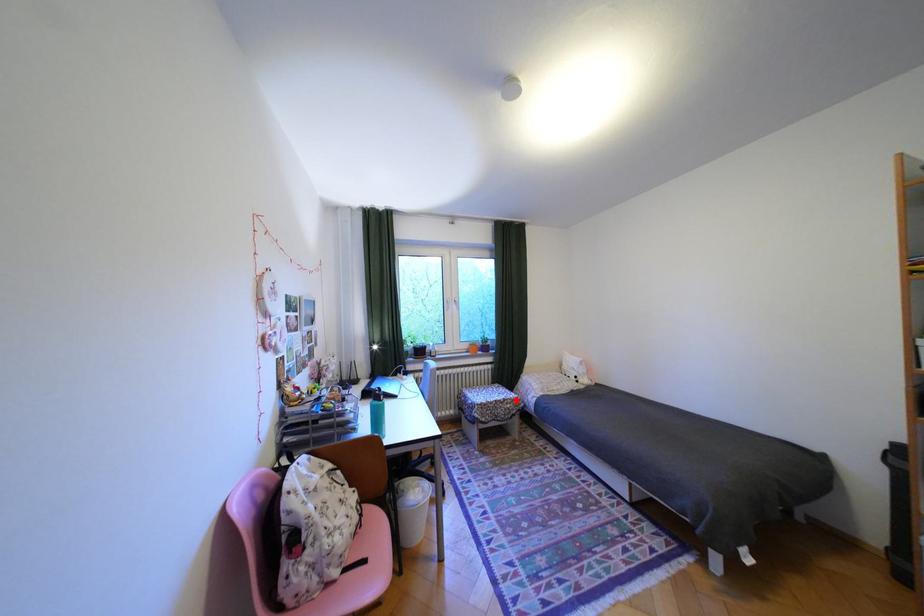
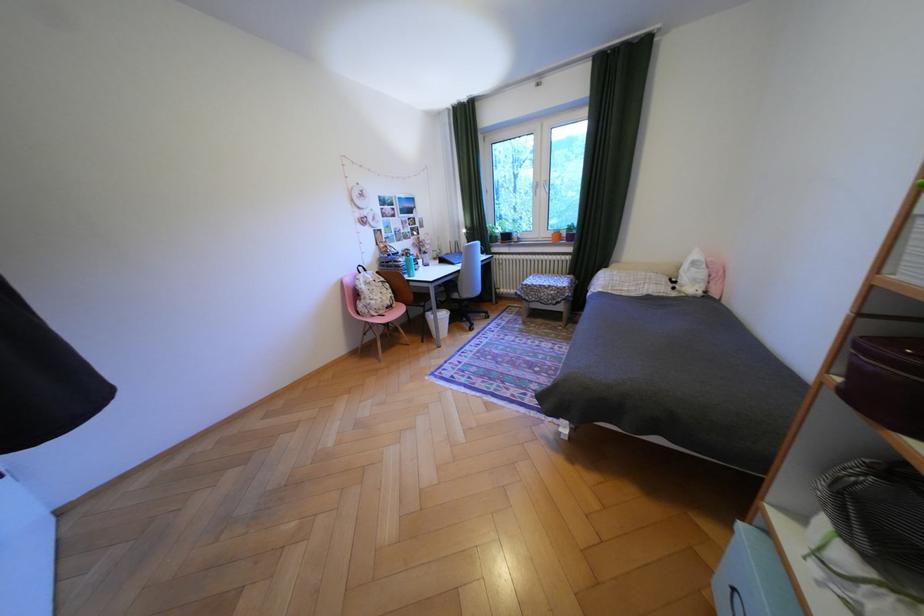
In the second image, find the point that corresponds to the highlighted location in the first image.

(562, 286)